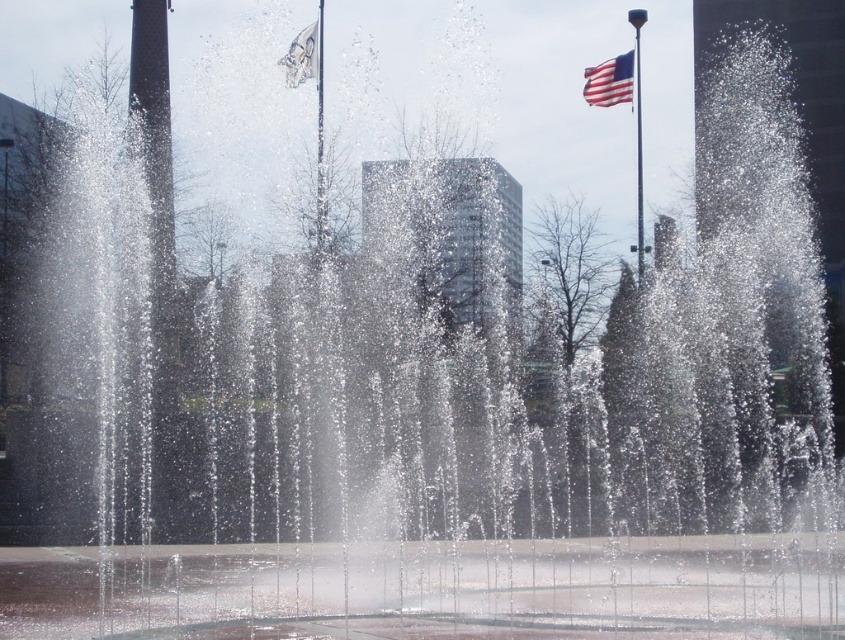
Question: Estimate the real-world distances between objects in this image. Which object is closer to the polished metal flag pole at upper right?

Choices:
 (A) american flag at upper right
 (B) white fabric flag at upper center
 (C) metallic flag pole at center

Answer: (A)

Question: Is metallic flag pole at center thinner than polished metal flag pole at upper right?

Choices:
 (A) yes
 (B) no

Answer: (A)

Question: Does metallic flag pole at center appear under white fabric flag at upper center?

Choices:
 (A) no
 (B) yes

Answer: (A)

Question: Which point appears closest to the camera in this image?

Choices:
 (A) (598, 92)
 (B) (323, 228)
 (C) (636, 104)
 (D) (315, 35)

Answer: (D)

Question: Which object is closer to the camera taking this photo?

Choices:
 (A) american flag at upper right
 (B) metallic flag pole at center
 (C) white fabric flag at upper center
 (D) polished metal flag pole at upper right

Answer: (D)

Question: Can you confirm if american flag at upper right is positioned to the left of white fabric flag at upper center?

Choices:
 (A) yes
 (B) no

Answer: (B)